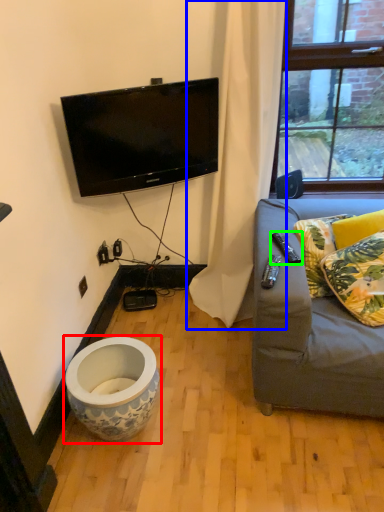
Question: Estimate the real-world distances between objects in this image. Which object is farther from toilet (highlighted by a red box), curtain (highlighted by a blue box) or remote (highlighted by a green box)?

Choices:
 (A) curtain
 (B) remote

Answer: (B)